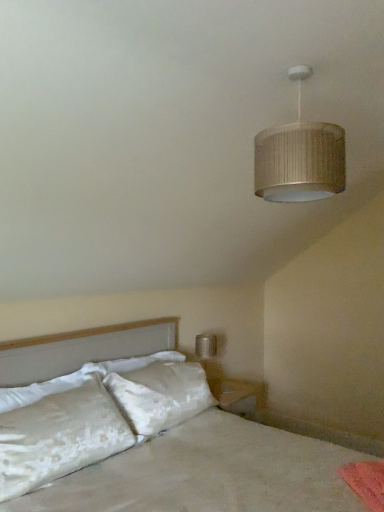
Question: Could you tell me if white satin bed at lower left is turned towards white soft pillow at left, the second pillow in the bottom-to-top sequence?

Choices:
 (A) no
 (B) yes

Answer: (A)

Question: Is white soft pillow at left, the first pillow when ordered from top to bottom, inside white satin bed at lower left?

Choices:
 (A) no
 (B) yes

Answer: (B)

Question: Is white satin bed at lower left touching white soft pillow at left, the second pillow in the bottom-to-top sequence?

Choices:
 (A) yes
 (B) no

Answer: (B)

Question: From a real-world perspective, is white satin bed at lower left below white soft pillow at left, the second pillow in the bottom-to-top sequence?

Choices:
 (A) no
 (B) yes

Answer: (B)

Question: Does white satin bed at lower left have a larger size compared to white soft pillow at left, the first pillow when ordered from top to bottom?

Choices:
 (A) no
 (B) yes

Answer: (B)

Question: Is white satin bed at lower left smaller than white soft pillow at left, the first pillow when ordered from top to bottom?

Choices:
 (A) no
 (B) yes

Answer: (A)

Question: Could you tell me if white soft pillow at left, the first pillow when ordered from top to bottom, is facing white satin bed at lower left?

Choices:
 (A) yes
 (B) no

Answer: (A)

Question: Does white soft pillow at left, the second pillow in the bottom-to-top sequence, have a smaller size compared to white satin bed at lower left?

Choices:
 (A) no
 (B) yes

Answer: (B)

Question: From the image's perspective, is white soft pillow at left, the first pillow when ordered from top to bottom, located beneath white satin bed at lower left?

Choices:
 (A) no
 (B) yes

Answer: (A)

Question: Is white soft pillow at left, the second pillow in the bottom-to-top sequence, in front of white satin bed at lower left?

Choices:
 (A) yes
 (B) no

Answer: (B)

Question: Is white soft pillow at left, the first pillow when ordered from top to bottom, placed right next to white satin bed at lower left?

Choices:
 (A) yes
 (B) no

Answer: (B)

Question: Does white soft pillow at left, the first pillow when ordered from top to bottom, have a lesser width compared to white satin bed at lower left?

Choices:
 (A) no
 (B) yes

Answer: (B)

Question: Is white velvety pillow at lower left, the 1th pillow in the bottom-to-top sequence, closer to the viewer compared to white soft pillow at left, the second pillow in the bottom-to-top sequence?

Choices:
 (A) yes
 (B) no

Answer: (A)